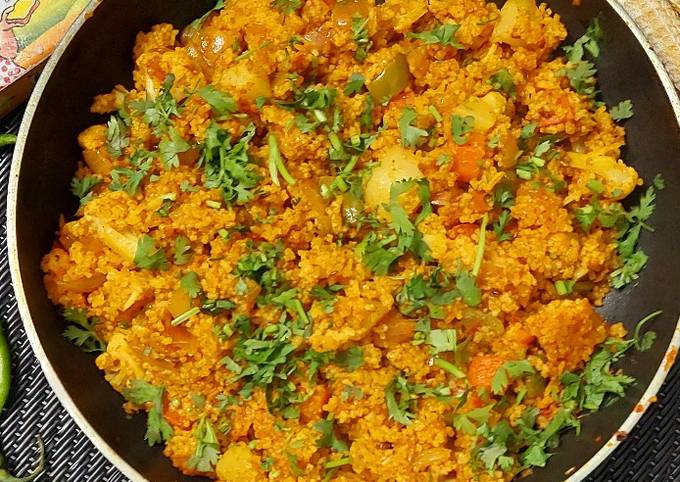
The width and height of the screenshot is (680, 482). I want to click on napkins would be to the right, so click(672, 438).